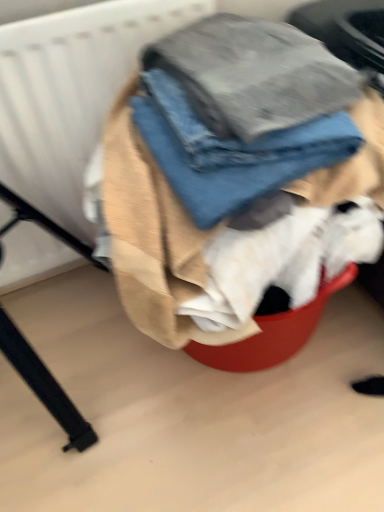
Question: Can you confirm if denim fabric at center is wider than denim jeans at center?

Choices:
 (A) yes
 (B) no

Answer: (A)

Question: Is denim jeans at center a part of denim fabric at center?

Choices:
 (A) no
 (B) yes

Answer: (B)

Question: From a real-world perspective, does denim fabric at center sit lower than denim jeans at center?

Choices:
 (A) yes
 (B) no

Answer: (A)

Question: Can you confirm if denim fabric at center is shorter than denim jeans at center?

Choices:
 (A) no
 (B) yes

Answer: (A)

Question: Does denim fabric at center come behind denim jeans at center?

Choices:
 (A) yes
 (B) no

Answer: (B)

Question: Considering the relative sizes of denim fabric at center and denim jeans at center in the image provided, is denim fabric at center taller than denim jeans at center?

Choices:
 (A) no
 (B) yes

Answer: (B)

Question: Is denim jeans at center positioned beyond the bounds of white textured radiator at upper left?

Choices:
 (A) no
 (B) yes

Answer: (B)

Question: From a real-world perspective, is denim jeans at center below white textured radiator at upper left?

Choices:
 (A) no
 (B) yes

Answer: (A)

Question: Is denim jeans at center behind white textured radiator at upper left?

Choices:
 (A) yes
 (B) no

Answer: (B)

Question: Is denim jeans at center at the left side of white textured radiator at upper left?

Choices:
 (A) yes
 (B) no

Answer: (B)

Question: Does denim jeans at center turn towards white textured radiator at upper left?

Choices:
 (A) no
 (B) yes

Answer: (A)

Question: Is denim jeans at center far away from white textured radiator at upper left?

Choices:
 (A) yes
 (B) no

Answer: (B)

Question: Can you confirm if white textured radiator at upper left is shorter than denim jeans at center?

Choices:
 (A) yes
 (B) no

Answer: (B)